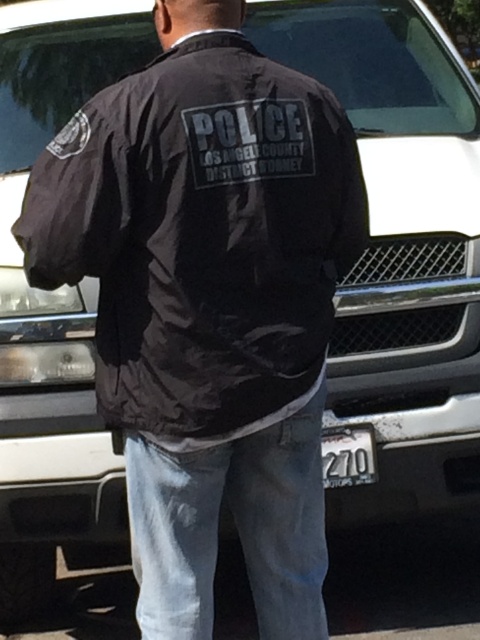
Does black nylon jacket at center have a greater height compared to white plastic license plate at lower center?

Yes.

Is the position of black nylon jacket at center less distant than that of white plastic license plate at lower center?

Yes.

Does point (168, 134) lie behind point (363, 438)?

No, (168, 134) is in front of (363, 438).

The image size is (480, 640). Find the location of `black nylon jacket at center`. black nylon jacket at center is located at coordinates (201, 234).